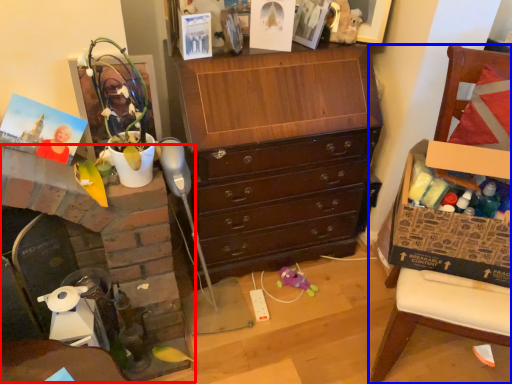
Question: Which object appears closest to the camera in this image, fireplace (highlighted by a red box) or furniture (highlighted by a blue box)?

Choices:
 (A) fireplace
 (B) furniture

Answer: (B)